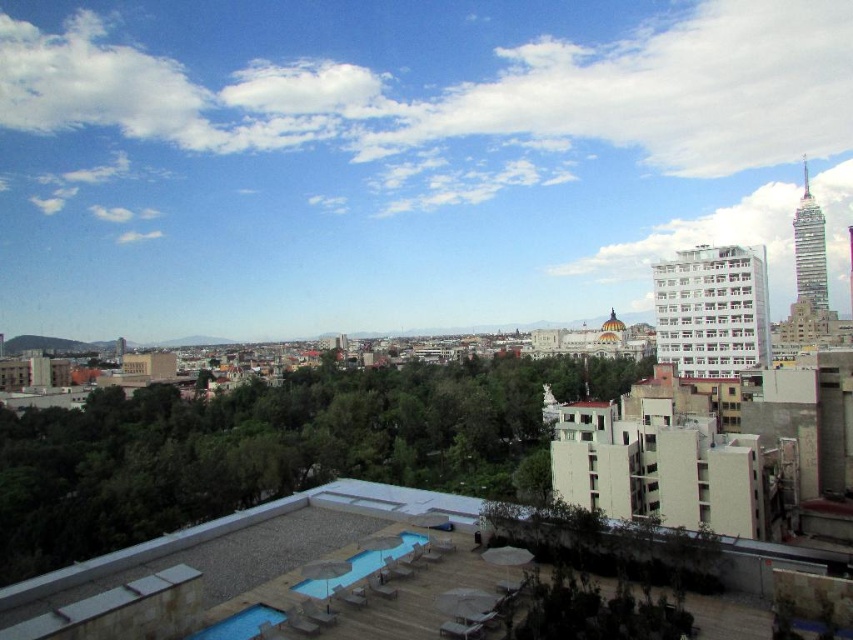
You are standing on the rooftop and see the blue smooth pool at lower center and the blue smooth pool at lower left. Which one is positioned to the right side from your perspective?

The blue smooth pool at lower center is positioned to the right of the blue smooth pool at lower left.